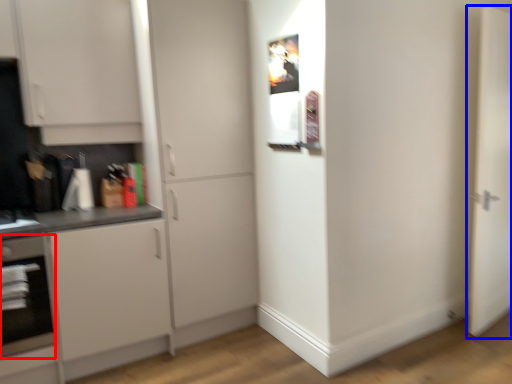
Question: Which of the following is the closest to the observer, oven (highlighted by a red box) or door (highlighted by a blue box)?

Choices:
 (A) oven
 (B) door

Answer: (A)